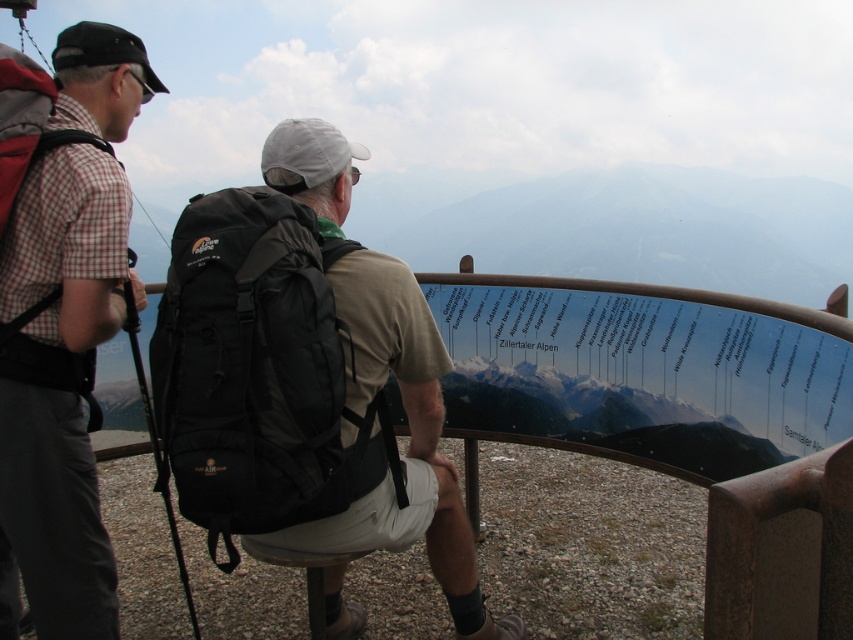
You are standing at the overlook and want to reach the point marked at coordinates (277, 464). Given that you are 5.87 feet away from it, can you estimate how many steps it would take you to walk there if each of your steps is approximately 2.5 feet long?

Since the distance between you and the point marked at coordinates (277, 464) is 5.87 feet, and each step is 2.5 feet long, you would need approximately 2 to 3 steps to reach it.

You are a photographer at the overlook and want to take a photo of the black fabric backpack at center. Where should you aim your camera to capture it?

Aim your camera at the 2D location point at approximately 0.583 on the x axis and 0.302 on the y axis to capture the black fabric backpack at center.

You are trying to locate the matte plaid shirt at left in the image. What are the coordinates where you should look?

The matte plaid shirt at left can be found at coordinates point (x=65, y=337).